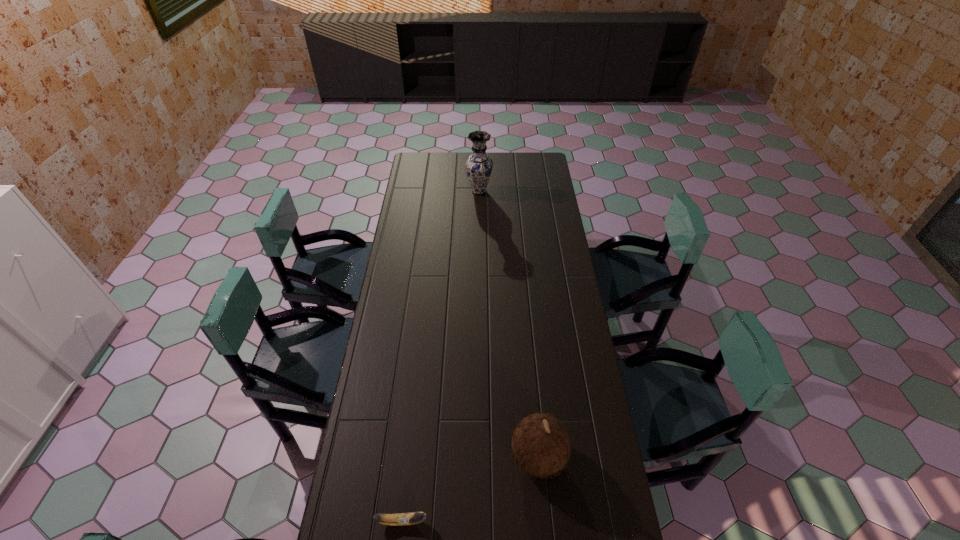
Find the location of `free space that is in between the second nearest object and the farthest object`. free space that is in between the second nearest object and the farthest object is located at coordinates (509, 323).

Find the location of `vacant area that lies between the banana and the vase`. vacant area that lies between the banana and the vase is located at coordinates (x=441, y=356).

Find the location of a particular element. This screenshot has width=960, height=540. free space between the banana and the tallest object is located at coordinates (441, 356).

At what (x,y) coordinates should I click in order to perform the action: click on empty space that is in between the farthest object and the second nearest object. Please return your answer as a coordinate pair (x, y). Looking at the image, I should click on (509, 323).

Locate an element on the screen. Image resolution: width=960 pixels, height=540 pixels. object that is the second closest to the banana is located at coordinates (479, 165).

This screenshot has width=960, height=540. I want to click on object identified as the closest to the vase, so click(x=540, y=444).

The width and height of the screenshot is (960, 540). Identify the location of vacant space that satisfies the following two spatial constraints: 1. on the front side of the tallest object; 2. on the peel of the banana. (479, 521).